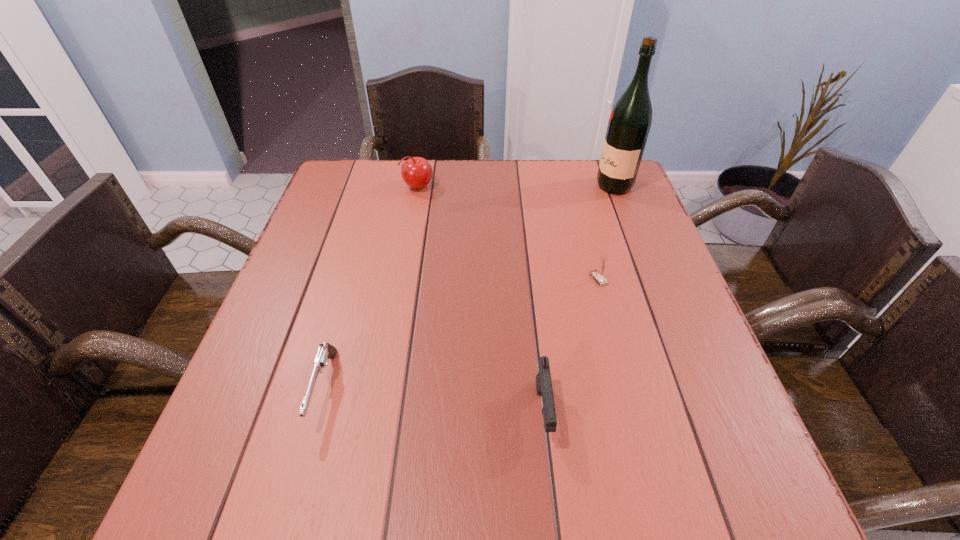
Locate an element on the screen. The image size is (960, 540). the tallest object is located at coordinates (629, 124).

The height and width of the screenshot is (540, 960). Find the location of `liquor`. liquor is located at coordinates (629, 124).

Locate an element on the screen. the second object from left to right is located at coordinates (416, 172).

Where is `the fourth shortest object`? This screenshot has width=960, height=540. the fourth shortest object is located at coordinates (416, 172).

Where is `the right pistol`? the right pistol is located at coordinates (543, 379).

The width and height of the screenshot is (960, 540). Identify the location of the third object from right to left. (543, 379).

This screenshot has height=540, width=960. What are the coordinates of `the fourth object from left to right` in the screenshot? It's located at (599, 276).

You are a GUI agent. You are given a task and a screenshot of the screen. Output one action in this format:
    pyautogui.click(x=<x>, y=<y>)
    Task: Click on the matchbox
    Image resolution: width=960 pixels, height=540 pixels.
    Given the screenshot: What is the action you would take?
    pyautogui.click(x=599, y=276)

You are a GUI agent. You are given a task and a screenshot of the screen. Output one action in this format:
    pyautogui.click(x=<x>, y=<y>)
    Task: Click on the shorter pistol
    Image resolution: width=960 pixels, height=540 pixels.
    Given the screenshot: What is the action you would take?
    pyautogui.click(x=326, y=351)

Where is `the left pistol`? Image resolution: width=960 pixels, height=540 pixels. the left pistol is located at coordinates (326, 351).